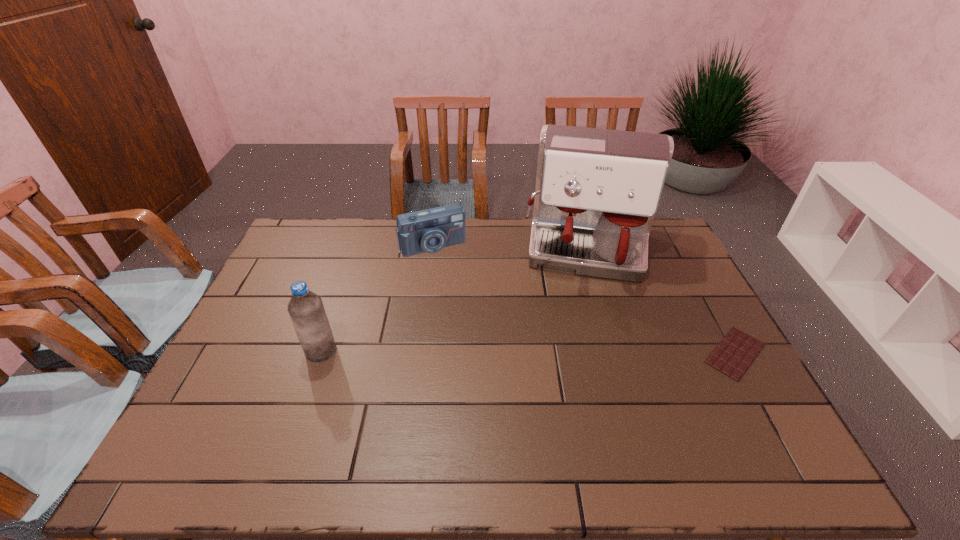
Identify the location of vacant space situated 0.110m on the lens of the camera. The height and width of the screenshot is (540, 960). (453, 278).

Where is `free space located 0.190m on the front of the tallest object near the spout`? Image resolution: width=960 pixels, height=540 pixels. free space located 0.190m on the front of the tallest object near the spout is located at coordinates (581, 335).

This screenshot has height=540, width=960. I want to click on free space located on the front of the tallest object near the spout, so click(x=579, y=351).

Find the location of a particular element. vacant region located 0.260m on the front of the tallest object near the spout is located at coordinates (579, 354).

The width and height of the screenshot is (960, 540). Identify the location of camera situated at the far edge. (430, 230).

Identify the location of coffee maker positioned at the far edge. This screenshot has width=960, height=540. (597, 191).

Where is `chocolate bar that is at the right edge`? chocolate bar that is at the right edge is located at coordinates (736, 351).

Locate an element on the screen. coffee maker present at the right edge is located at coordinates (597, 191).

You are a GUI agent. You are given a task and a screenshot of the screen. Output one action in this format:
    pyautogui.click(x=<x>, y=<y>)
    Task: Click on the object that is at the far right corner
    
    Given the screenshot: What is the action you would take?
    pyautogui.click(x=597, y=191)

The image size is (960, 540). In the image, there is a desktop. What are the coordinates of `vacant space at the far edge` in the screenshot? It's located at (521, 251).